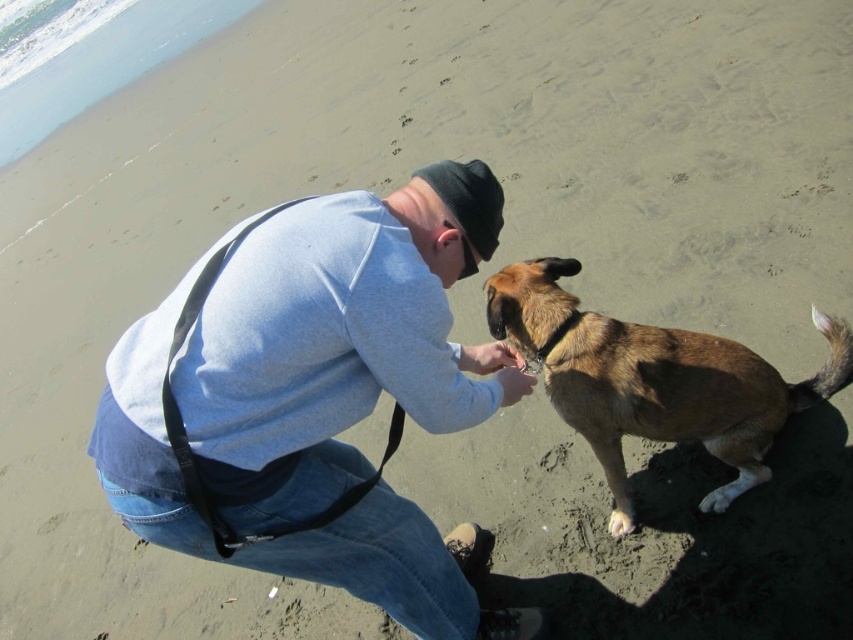
You are a photographer trying to capture the man and dog interaction. You want to place your camera exactly at point (320, 396) to get the best shot. What object should you focus on at that point?

The light blue sweater at center is located at point (320, 396), so you should focus on the light blue sweater at center.

From the picture: You are a photographer trying to capture a closeup of the light blue sweater at center and the white fur paw at lower right. Which object should you zoom in on first if you want to focus on the one that is closer to the camera?

The white fur paw at lower right is closer to the camera than the light blue sweater at center, so you should zoom in on the white fur paw at lower right first.